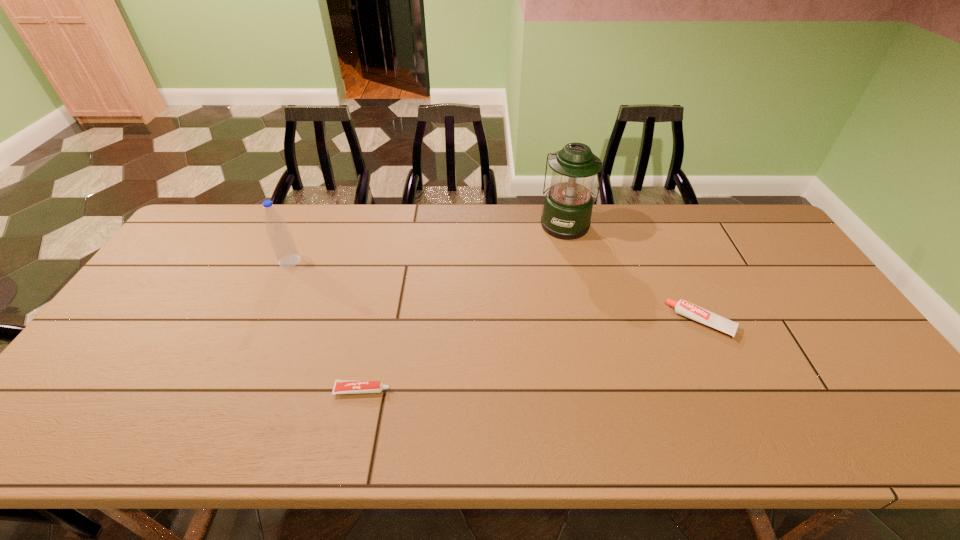
Identify which object is located as the second nearest to the third farthest object. Please provide its 2D coordinates. Your answer should be formatted as a tuple, i.e. [(x, y)], where the tuple contains the x and y coordinates of a point satisfying the conditions above.

[(341, 386)]

This screenshot has height=540, width=960. I want to click on object that stands as the third closest to the tallest object, so click(x=281, y=240).

Where is `free space that satisfies the following two spatial constraints: 1. on the front side of the second nearest object; 2. on the left side of the leftmost object`? The width and height of the screenshot is (960, 540). free space that satisfies the following two spatial constraints: 1. on the front side of the second nearest object; 2. on the left side of the leftmost object is located at coordinates (262, 322).

The width and height of the screenshot is (960, 540). I want to click on free space that satisfies the following two spatial constraints: 1. on the front side of the farther toothpaste; 2. on the right side of the third object from left to right, so click(x=588, y=322).

This screenshot has width=960, height=540. Identify the location of free point that satisfies the following two spatial constraints: 1. on the front side of the right toothpaste; 2. on the left side of the water bottle. (262, 322).